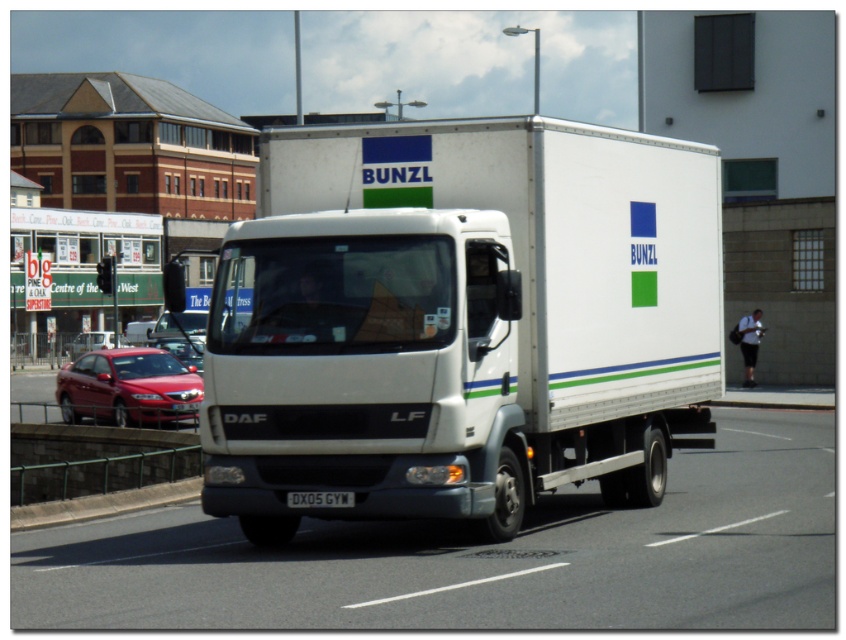
You are a delivery driver planning to park your white matte truck at center between two other vehicles. The space between the shiny red sedan at lower left and another vehicle on the right is 2 meters. Can your truck fit in the space?

The white matte truck at center is thinner than the shiny red sedan at lower left, so it can fit in the 2 meter space between the two vehicles.

You are a pedestrian standing at the bus stop sign on the left. You see two points marked on the road ahead of you. The first point is at coordinates point (224,291) and the second is at point (330,506). Which point is closer to you?

Point (224,291) is closer to you because it is further to the viewer than point (330,506), meaning it is nearer in the scene.

You are a city planner analyzing traffic patterns. You observe the white matte truck at center and the shiny red sedan at lower left in the scene. Which vehicle takes up more space in the image?

The shiny red sedan at lower left takes up more space in the image because the white matte truck at center occupies less space than the shiny red sedan at lower left.